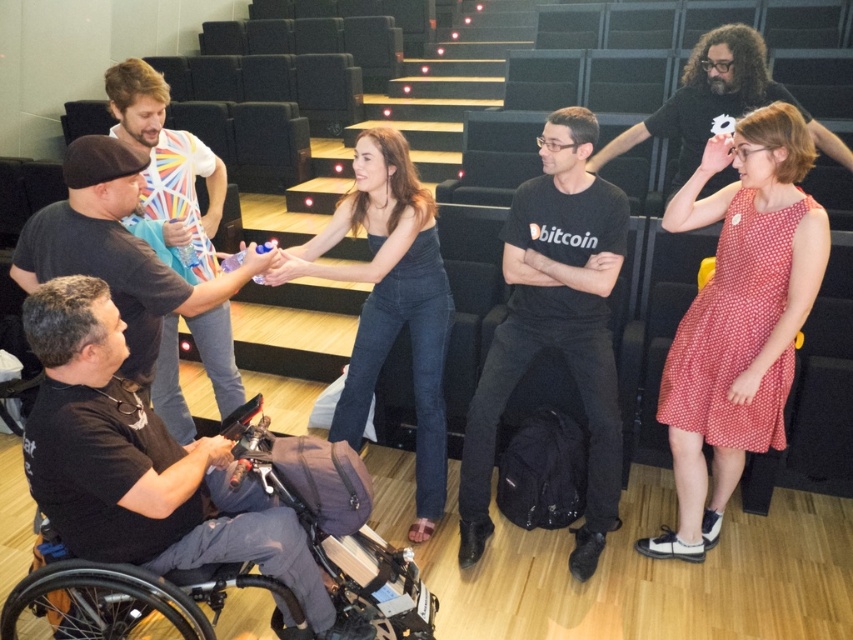
Question: Which point appears closest to the camera in this image?

Choices:
 (A) (817, 140)
 (B) (728, 288)
 (C) (428, 378)

Answer: (B)

Question: Does black plastic wheelchair at lower left appear on the left side of dark brown hair at upper right?

Choices:
 (A) yes
 (B) no

Answer: (A)

Question: Considering the real-world distances, which object is closest to the dark brown hair at upper right?

Choices:
 (A) white printed t-shirt at center
 (B) black matte t-shirt at center

Answer: (B)

Question: From the image, what is the correct spatial relationship of black matte wheelchair at lower left in relation to dark brown hair at upper right?

Choices:
 (A) right
 (B) left

Answer: (B)

Question: Estimate the real-world distances between objects in this image. Which object is closer to the red polka dot dress at center?

Choices:
 (A) white printed t-shirt at center
 (B) matte black tank top at center
 (C) dark brown hair at upper right
 (D) black matte wheelchair at lower left

Answer: (B)

Question: Considering the relative positions of black matte t-shirt at center and black matte wheelchair at lower left in the image provided, where is black matte t-shirt at center located with respect to black matte wheelchair at lower left?

Choices:
 (A) above
 (B) below

Answer: (B)